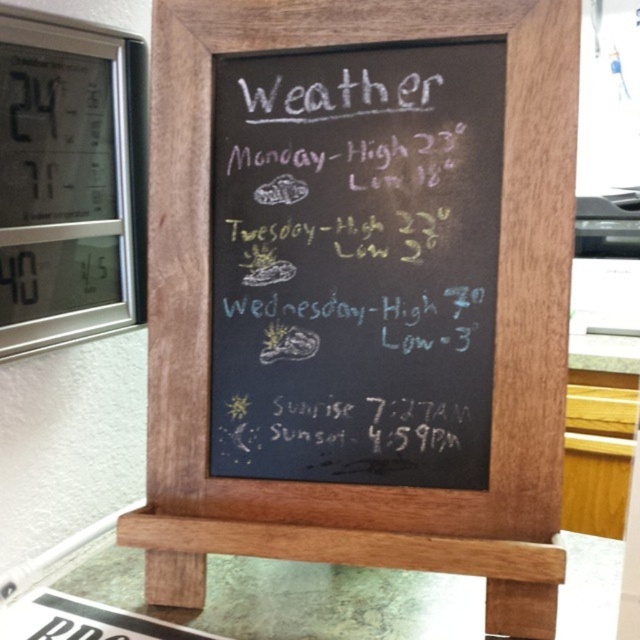
Question: Which of these objects is positioned farthest from the silver digital clock at upper left?

Choices:
 (A) white chalkboard at center
 (B) white paperboard menu at center

Answer: (B)

Question: Where is white paperboard menu at center located in relation to brown wood stool at center in the image?

Choices:
 (A) above
 (B) below

Answer: (A)

Question: Which point is farther to the camera?

Choices:
 (A) white chalkboard at center
 (B) brown wood stool at center
 (C) white paperboard menu at center
 (D) silver digital clock at upper left

Answer: (D)

Question: Which point is closer to the camera?

Choices:
 (A) white paperboard menu at center
 (B) brown wood stool at center
 (C) white chalkboard at center

Answer: (B)

Question: Does white paperboard menu at center have a smaller size compared to brown wood stool at center?

Choices:
 (A) no
 (B) yes

Answer: (A)

Question: Does silver digital clock at upper left appear on the right side of brown wood stool at center?

Choices:
 (A) yes
 (B) no

Answer: (B)